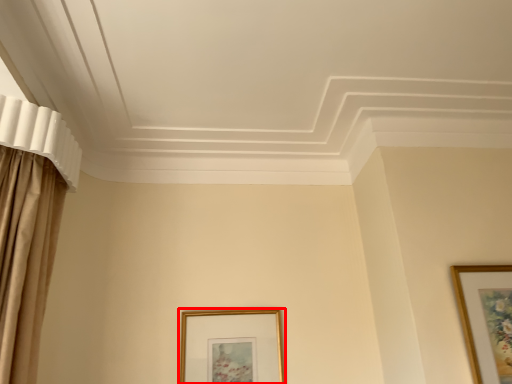
Question: Considering the relative positions of picture frame (annotated by the red box) and picture frame in the image provided, where is picture frame (annotated by the red box) located with respect to the staircase?

Choices:
 (A) left
 (B) right

Answer: (A)